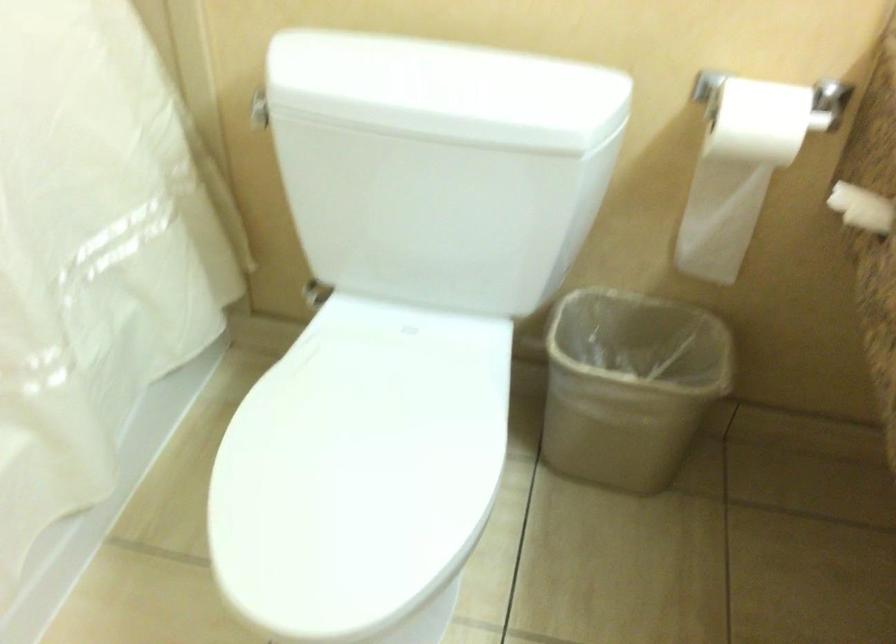
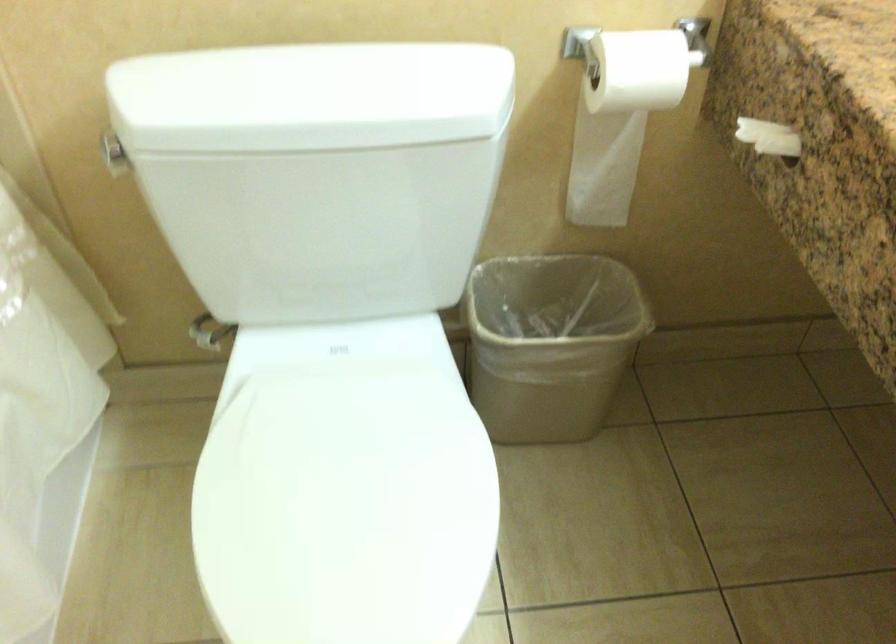
Question: The first image is from the beginning of the video and the second image is from the end. How did the camera likely rotate when shooting the video?

Choices:
 (A) Left
 (B) Right
 (C) Up
 (D) Down

Answer: (B)